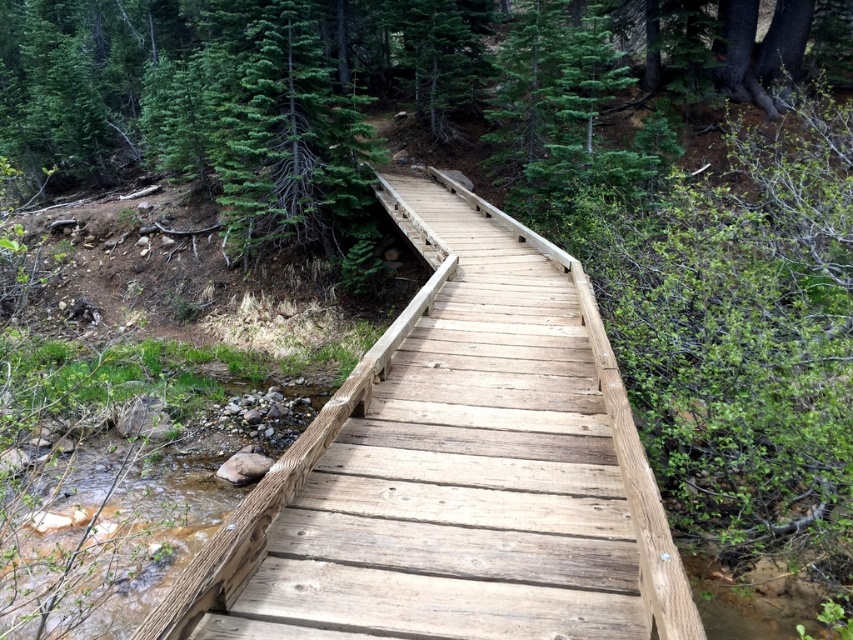
Is natural wood bridge at center bigger than green matte tree at upper center?

Actually, natural wood bridge at center might be smaller than green matte tree at upper center.

Which is in front, point (640, 611) or point (314, 134)?

Point (640, 611)

Does point (364, 573) lie behind point (364, 172)?

No, (364, 573) is closer to viewer.

Locate an element on the screen. The height and width of the screenshot is (640, 853). natural wood bridge at center is located at coordinates (454, 468).